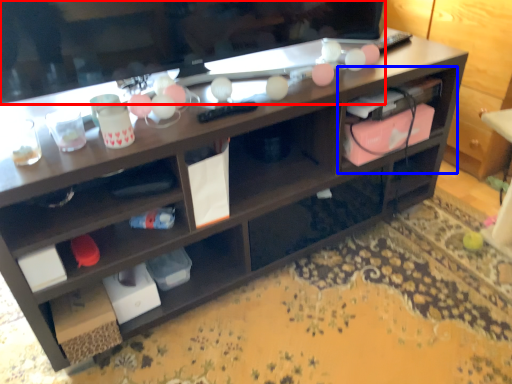
Question: Among these objects, which one is nearest to the camera, television (highlighted by a red box) or cabinet (highlighted by a blue box)?

Choices:
 (A) television
 (B) cabinet

Answer: (A)